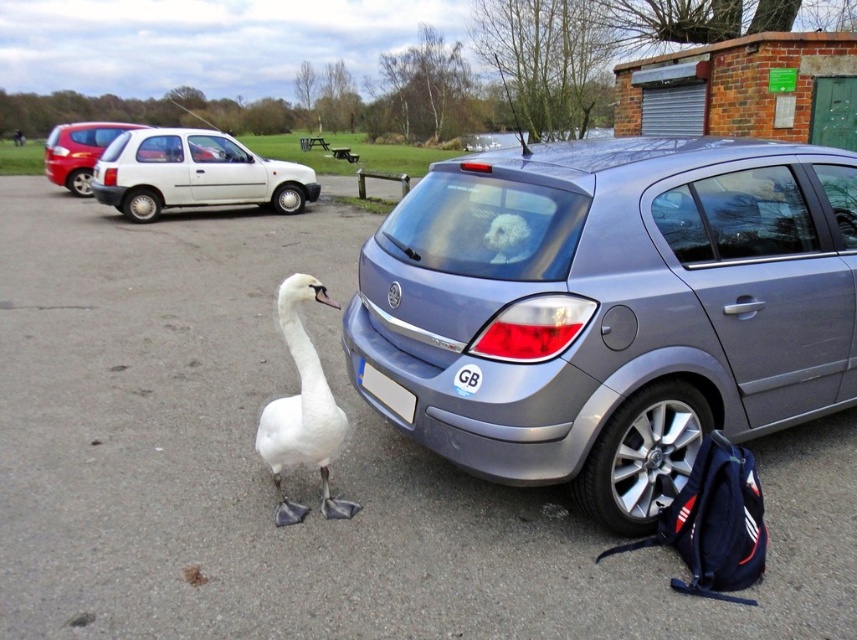
Can you confirm if matte red hatchback at left is smaller than white plastic license plate at rear?

Actually, matte red hatchback at left might be larger than white plastic license plate at rear.

Who is more distant from viewer, (58, 172) or (409, 419)?

Point (58, 172)

Does point (91, 195) lie behind point (388, 378)?

Yes, point (91, 195) is behind point (388, 378).

Find the location of `matte red hatchback at left`. matte red hatchback at left is located at coordinates (78, 150).

Is white matte hatchback at left closer to the viewer compared to matte red hatchback at left?

Yes, it is in front of matte red hatchback at left.

Is white matte hatchback at left below matte red hatchback at left?

Correct, white matte hatchback at left is located below matte red hatchback at left.

Is point (240, 160) positioned before point (70, 131)?

Yes, it is.

Locate an element on the screen. Image resolution: width=857 pixels, height=640 pixels. white matte hatchback at left is located at coordinates (195, 173).

Between satin silver car at center and white glossy goose at center, which one has more height?

Standing taller between the two is satin silver car at center.

Measure the distance from satin silver car at center to white glossy goose at center.

The distance of satin silver car at center from white glossy goose at center is 4.26 feet.

The image size is (857, 640). Identify the location of satin silver car at center. (612, 308).